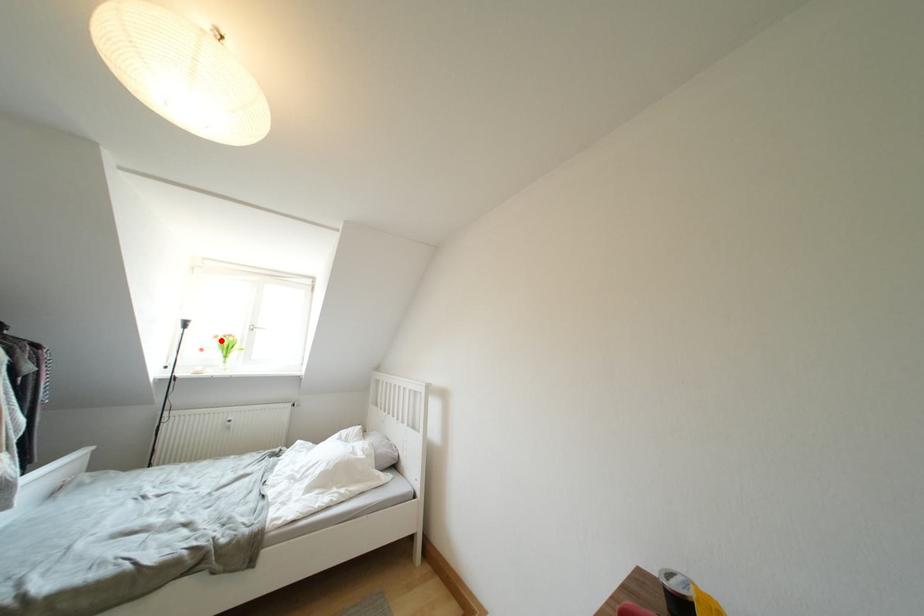
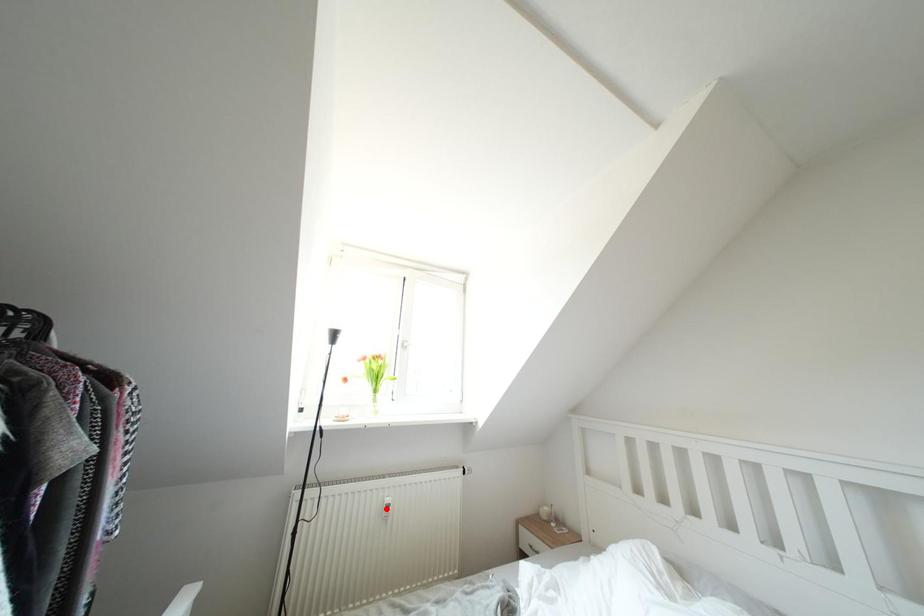
I am providing you with two images of the same scene from different viewpoints. A red point is marked on the first image and another point is marked on the second image. Is the red point in image1 aligned with the point shown in image2?

No